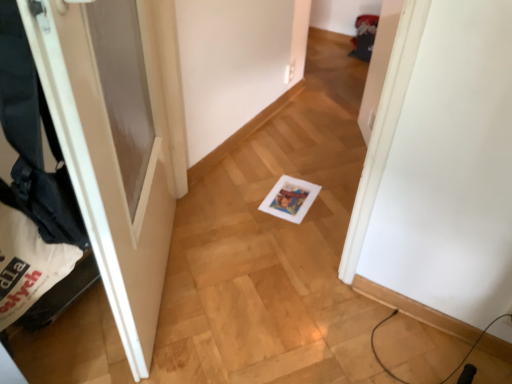
Question: Looking at the image, does white matte door at left seem bigger or smaller compared to black fabric laundry at left?

Choices:
 (A) big
 (B) small

Answer: (A)

Question: In terms of height, does white matte door at left look taller or shorter compared to black fabric laundry at left?

Choices:
 (A) short
 (B) tall

Answer: (B)

Question: From the image's perspective, is white matte door at left positioned above or below black fabric laundry at left?

Choices:
 (A) above
 (B) below

Answer: (A)

Question: Choose the correct answer: Is black fabric laundry at left inside white matte door at left or outside it?

Choices:
 (A) outside
 (B) inside

Answer: (B)

Question: Is point (26, 193) positioned closer to the camera than point (120, 162)?

Choices:
 (A) closer
 (B) farther

Answer: (A)

Question: From the image's perspective, is black fabric laundry at left located above or below white matte door at left?

Choices:
 (A) below
 (B) above

Answer: (A)

Question: In the image, is black fabric laundry at left on the left side or the right side of white matte door at left?

Choices:
 (A) right
 (B) left

Answer: (B)